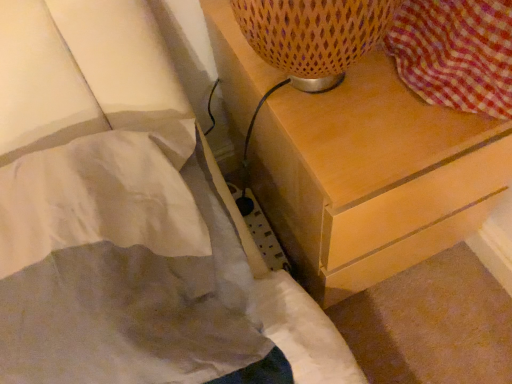
Question: Can you confirm if light brown wood chest of drawers at upper right is thinner than white fabric bed at lower left?

Choices:
 (A) yes
 (B) no

Answer: (B)

Question: Is white fabric bed at lower left surrounded by light brown wood chest of drawers at upper right?

Choices:
 (A) yes
 (B) no

Answer: (B)

Question: Does light brown wood chest of drawers at upper right have a larger size compared to white fabric bed at lower left?

Choices:
 (A) yes
 (B) no

Answer: (A)

Question: Considering the relative sizes of light brown wood chest of drawers at upper right and white fabric bed at lower left in the image provided, is light brown wood chest of drawers at upper right shorter than white fabric bed at lower left?

Choices:
 (A) no
 (B) yes

Answer: (A)

Question: From the image's perspective, would you say light brown wood chest of drawers at upper right is positioned over white fabric bed at lower left?

Choices:
 (A) no
 (B) yes

Answer: (B)

Question: From the image's perspective, does light brown wood chest of drawers at upper right appear lower than white fabric bed at lower left?

Choices:
 (A) yes
 (B) no

Answer: (B)

Question: Is white fabric bed at lower left turned away from light brown wood chest of drawers at upper right?

Choices:
 (A) no
 (B) yes

Answer: (A)

Question: Does white fabric bed at lower left appear on the left side of light brown wood chest of drawers at upper right?

Choices:
 (A) no
 (B) yes

Answer: (B)

Question: From the image's perspective, is white fabric bed at lower left on light brown wood chest of drawers at upper right?

Choices:
 (A) no
 (B) yes

Answer: (A)

Question: From a real-world perspective, is white fabric bed at lower left physically above light brown wood chest of drawers at upper right?

Choices:
 (A) no
 (B) yes

Answer: (B)

Question: Is white fabric bed at lower left wider than light brown wood chest of drawers at upper right?

Choices:
 (A) yes
 (B) no

Answer: (B)

Question: From a real-world perspective, is white fabric bed at lower left positioned under light brown wood chest of drawers at upper right based on gravity?

Choices:
 (A) no
 (B) yes

Answer: (A)

Question: From the image's perspective, relative to light brown wood chest of drawers at upper right, is white fabric bed at lower left above or below?

Choices:
 (A) above
 (B) below

Answer: (B)